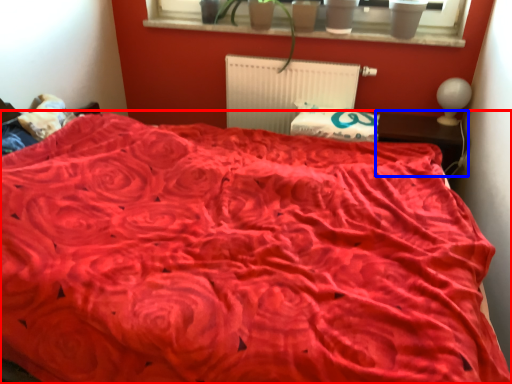
Question: Which object appears farthest to the camera in this image, bed (highlighted by a red box) or table (highlighted by a blue box)?

Choices:
 (A) bed
 (B) table

Answer: (B)